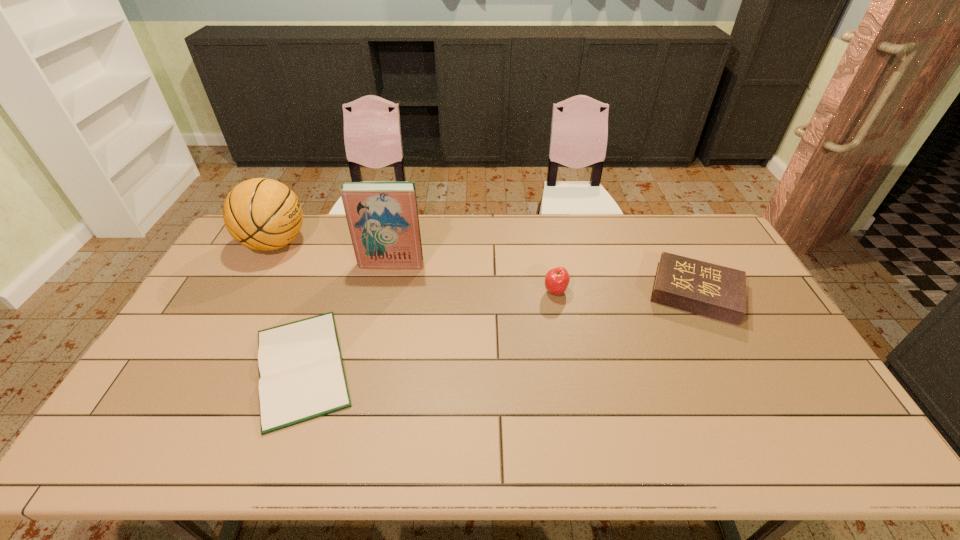
In the image, there is a desktop. At what (x,y) coordinates should I click in order to perform the action: click on vacant space at the right edge. Please return your answer as a coordinate pair (x, y). Looking at the image, I should click on (802, 375).

In the image, there is a desktop. Where is `vacant area at the far right corner`? This screenshot has width=960, height=540. vacant area at the far right corner is located at coordinates (724, 249).

Find the location of `free spot between the second tallest hardback book and the shortest object`. free spot between the second tallest hardback book and the shortest object is located at coordinates [x=499, y=330].

The height and width of the screenshot is (540, 960). I want to click on free space between the second tallest object and the shortest object, so click(289, 305).

The width and height of the screenshot is (960, 540). What are the coordinates of `free area in between the rightmost hardback book and the tallest object` in the screenshot? It's located at (543, 278).

The width and height of the screenshot is (960, 540). Find the location of `free space between the basketball and the fourth tallest object`. free space between the basketball and the fourth tallest object is located at coordinates [x=486, y=268].

Locate an element on the screen. empty space between the shortest object and the tallest object is located at coordinates (347, 315).

Locate an element on the screen. empty space between the rightmost hardback book and the basketball is located at coordinates (486, 268).

Where is `free space between the second tallest object and the tallest object`? The width and height of the screenshot is (960, 540). free space between the second tallest object and the tallest object is located at coordinates (333, 254).

Find the location of `unoccupied position between the second tallest hardback book and the fourth object from left to right`. unoccupied position between the second tallest hardback book and the fourth object from left to right is located at coordinates (626, 292).